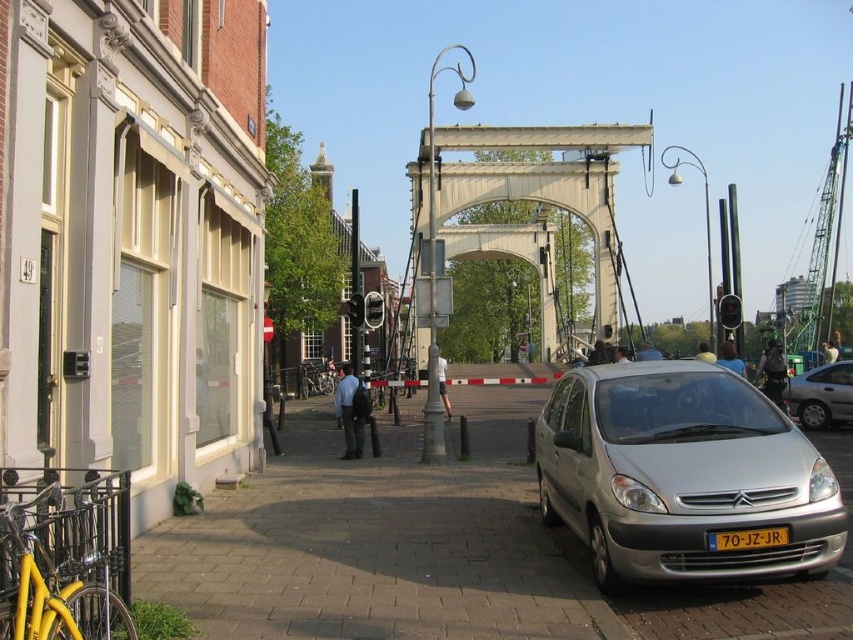
Question: Which of these objects is positioned closest to the white fabric shirt at center?

Choices:
 (A) light gray fabric pants at center
 (B) yellow plastic license plate at center
 (C) white metallic bridge at center
 (D) dark blue shirt at center

Answer: (A)

Question: Does white metallic bridge at center have a larger size compared to blue denim jacket at center?

Choices:
 (A) yes
 (B) no

Answer: (A)

Question: Considering the real-world distances, which object is closest to the yellow matte bicycle at lower left?

Choices:
 (A) smooth concrete pavement at center
 (B) white metallic bridge at center
 (C) blue denim jacket at center

Answer: (A)

Question: Among these points, which one is nearest to the camera?

Choices:
 (A) (602, 579)
 (B) (705, 346)
 (C) (740, 371)
 (D) (444, 403)

Answer: (A)

Question: Can you confirm if light brown leather jacket at center is positioned to the left of yellow fabric cap at center?

Choices:
 (A) yes
 (B) no

Answer: (A)

Question: Does dark blue shirt at center have a lesser width compared to light gray fabric pants at center?

Choices:
 (A) yes
 (B) no

Answer: (B)